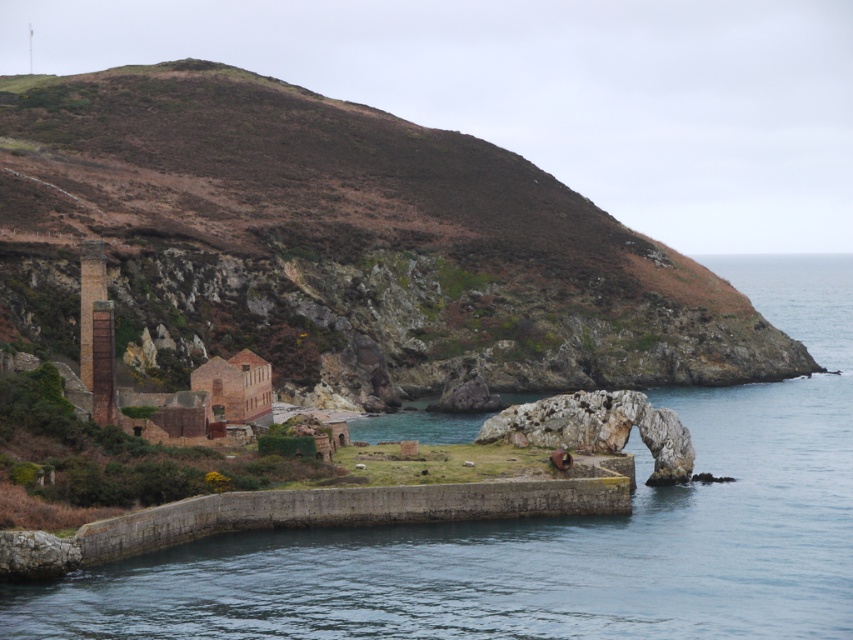
You are a landscape architect designing a new walking path. You need to decide whether to place the path closer to the brown rocky hillside at upper left or the concrete wall at center. Which area has more horizontal space available for the path?

The brown rocky hillside at upper left might be wider than the concrete wall at center, so the path should be placed closer to the brown rocky hillside at upper left to utilize its wider horizontal space.

You are a hiker planning to take a photo of the concrete wall at center from the brown rocky hillside at upper left. Is the hillside high enough to give you a clear view of the wall?

The brown rocky hillside at upper left is above concrete wall at center, so yes, the hillside is high enough to provide a clear view of the wall.